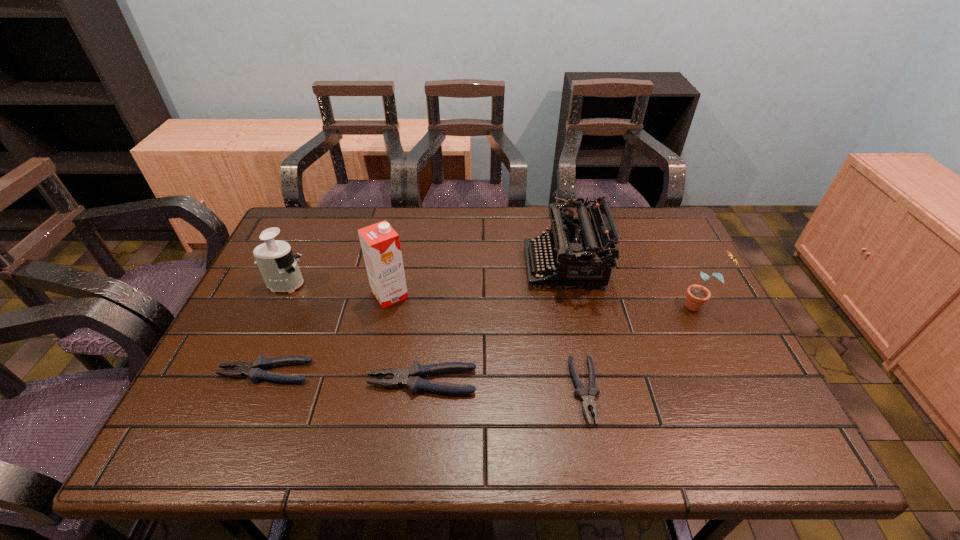
Where is `the leftmost pliers`? This screenshot has height=540, width=960. the leftmost pliers is located at coordinates (255, 370).

Locate an element on the screen. Image resolution: width=960 pixels, height=540 pixels. the second shortest pliers is located at coordinates (255, 370).

The width and height of the screenshot is (960, 540). I want to click on the second pliers from left to right, so click(x=411, y=378).

Find the location of a particular element. The height and width of the screenshot is (540, 960). the shortest pliers is located at coordinates (588, 401).

You are a GUI agent. You are given a task and a screenshot of the screen. Output one action in this format:
    pyautogui.click(x=<x>, y=<y>)
    Task: Click on the rightmost pliers
    
    Given the screenshot: What is the action you would take?
    pyautogui.click(x=588, y=401)

Identify the location of typewriter. Image resolution: width=960 pixels, height=540 pixels. (582, 251).

Identify the location of the tallest object. Image resolution: width=960 pixels, height=540 pixels. (380, 243).

Find the location of a particular element. The height and width of the screenshot is (540, 960). the rightmost object is located at coordinates (697, 295).

This screenshot has height=540, width=960. What are the coordinates of `juicer` in the screenshot? It's located at (279, 269).

Locate an element on the screen. vacant space positioned at the gripping part of the second pliers from right to left is located at coordinates (276, 381).